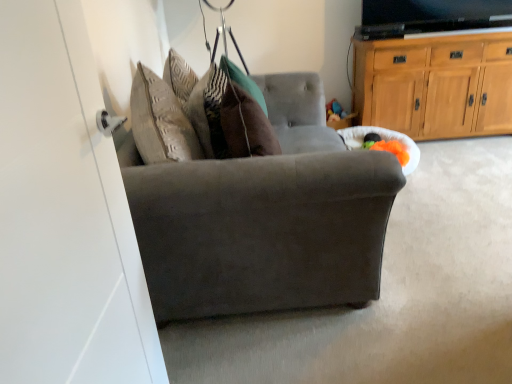
Question: Can you confirm if suede gray chair at center is shorter than light brown wood cabinet at upper right?

Choices:
 (A) no
 (B) yes

Answer: (B)

Question: From a real-world perspective, is suede gray chair at center below light brown wood cabinet at upper right?

Choices:
 (A) yes
 (B) no

Answer: (A)

Question: From the image's perspective, does suede gray chair at center appear higher than light brown wood cabinet at upper right?

Choices:
 (A) no
 (B) yes

Answer: (A)

Question: From a real-world perspective, is suede gray chair at center on top of light brown wood cabinet at upper right?

Choices:
 (A) no
 (B) yes

Answer: (A)

Question: Is suede gray chair at center thinner than light brown wood cabinet at upper right?

Choices:
 (A) yes
 (B) no

Answer: (B)

Question: In terms of height, does suede gray chair at center look taller or shorter compared to light brown wood cabinet at upper right?

Choices:
 (A) short
 (B) tall

Answer: (A)

Question: Would you say suede gray chair at center is to the left or to the right of light brown wood cabinet at upper right in the picture?

Choices:
 (A) left
 (B) right

Answer: (A)

Question: In terms of size, does suede gray chair at center appear bigger or smaller than light brown wood cabinet at upper right?

Choices:
 (A) big
 (B) small

Answer: (A)

Question: From the image's perspective, is suede gray chair at center located above or below light brown wood cabinet at upper right?

Choices:
 (A) above
 (B) below

Answer: (B)

Question: Relative to suede gray chair at center, is light brown wood cabinet at upper right in front or behind?

Choices:
 (A) behind
 (B) front

Answer: (A)

Question: From a real-world perspective, is light brown wood cabinet at upper right positioned above or below suede gray chair at center?

Choices:
 (A) below
 (B) above

Answer: (B)

Question: From the image's perspective, is light brown wood cabinet at upper right positioned above or below suede gray chair at center?

Choices:
 (A) below
 (B) above

Answer: (B)

Question: In terms of width, does light brown wood cabinet at upper right look wider or thinner when compared to suede gray chair at center?

Choices:
 (A) wide
 (B) thin

Answer: (B)

Question: Is point (457, 71) positioned closer to the camera than point (231, 96)?

Choices:
 (A) closer
 (B) farther

Answer: (B)

Question: From their relative heights in the image, would you say light brown wood cabinet at upper right is taller or shorter than brown velvet pillow at center?

Choices:
 (A) tall
 (B) short

Answer: (A)